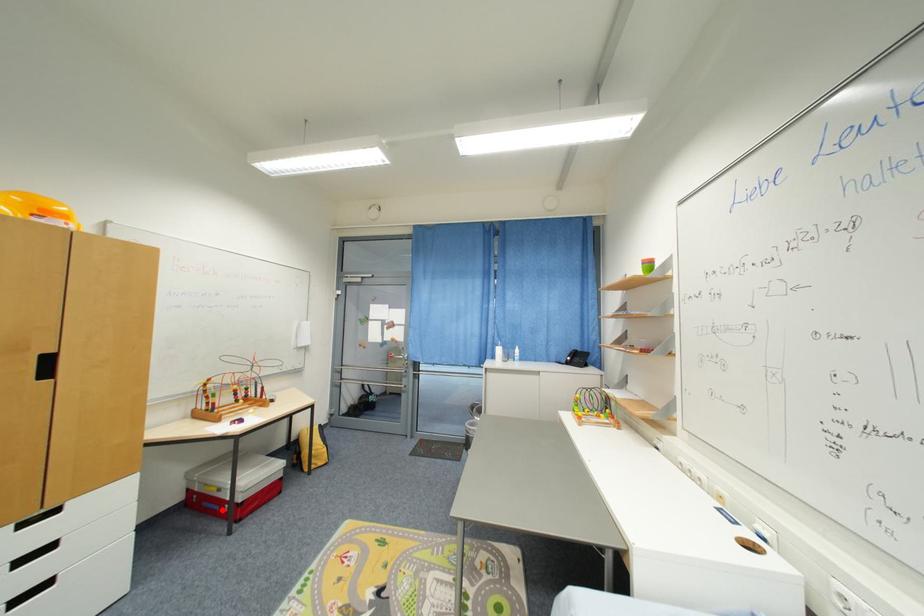
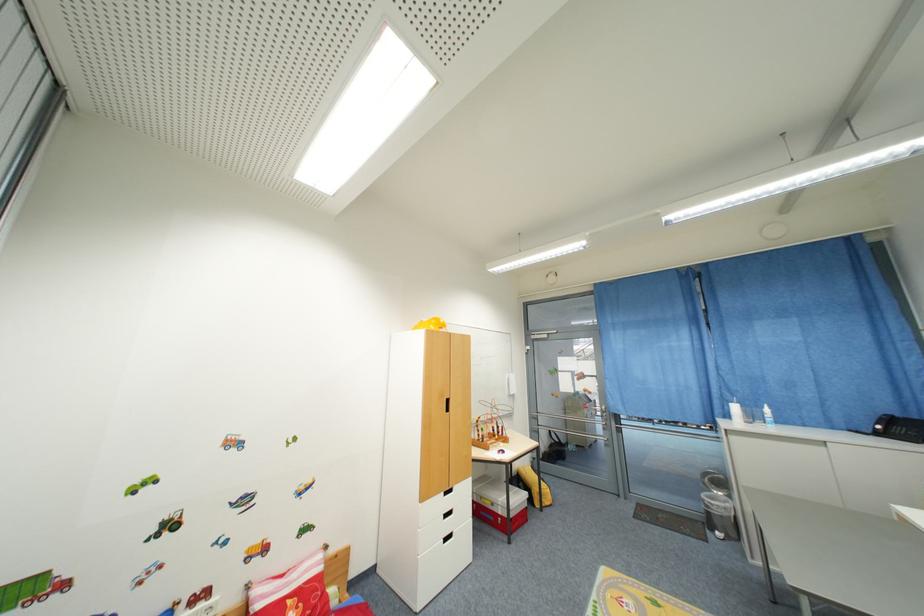
Question: I am providing you with two images of the same scene from different viewpoints. A red point is marked on the first image. Is the red point's position out of view in image 2?

Choices:
 (A) Yes
 (B) No

Answer: (B)